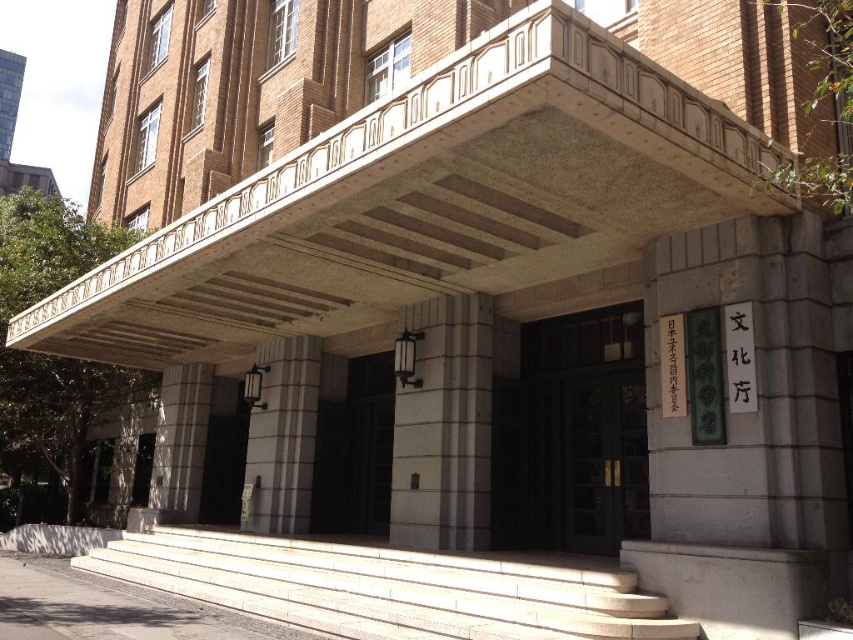
Looking at this image, you are standing at the entrance of the grand building and want to take a photo that includes both the point at coordinates point (285, 605) and point (306, 445). Since one is closer to you than the other, which point should you focus on to ensure both are in focus?

You should focus on point (306, 445) because it is farther away from you than point (285, 605). When focusing on the farther point, the closer point will still be within the depth of field, ensuring both are in focus.

You are a delivery person with a cart that is 5 feet wide. You need to move your cart from the street to the entrance of the building. The entrance has white stone stairs at center and white stone pillar at center. Can you fit your cart between them?

The white stone stairs at center and white stone pillar at center are 6.20 feet apart. Since your cart is 5 feet wide, it can fit between them as the distance is wider than the cart.

You are standing at the entrance of the grand building and want to touch both the white stone pillar at center and the white stone column at center. Which one should you reach for first to touch the one closer to you?

You should reach for the white stone pillar at center first because it is closer to you than the white stone column at center.